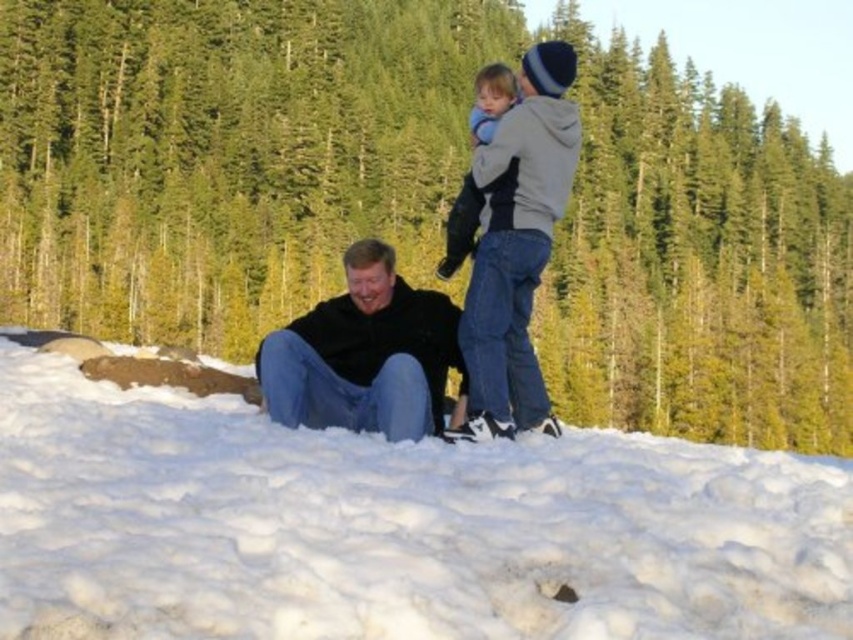
You are standing in the snowy scene and want to place a small flag at the point closer to you. Which point should you choose between point [741,298] and point [476,116]?

Point [741,298] is further to the viewer than point [476,116], so you should choose point [741,298] to place the small flag closer to you.

You are standing in the snowy scene and want to take a photo of the black matte jacket at lower center without the white fluffy snow at lower center appearing in the foreground. Is this possible?

The white fluffy snow at lower center is closer to the viewer than the black matte jacket at lower center, so it will block the jacket in the foreground. Therefore, it is not possible to take a photo of the black matte jacket at lower center without the white fluffy snow at lower center appearing in the foreground.